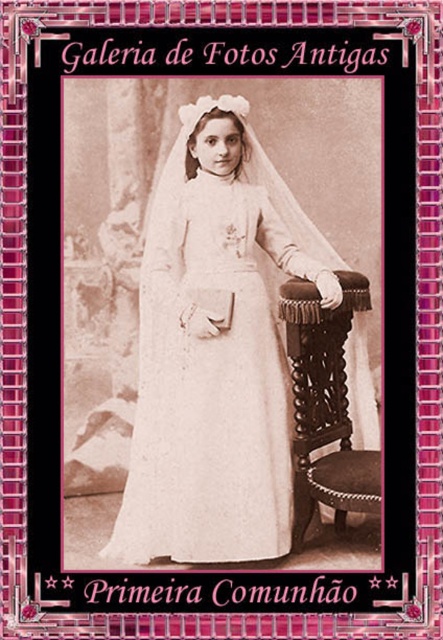
Which of these two, white lace dress at center or brown wood stool at right, stands shorter?

Standing shorter between the two is brown wood stool at right.

Can you confirm if white lace dress at center is smaller than brown wood stool at right?

Actually, white lace dress at center might be larger than brown wood stool at right.

Find the location of a particular element. white lace dress at center is located at coordinates (216, 349).